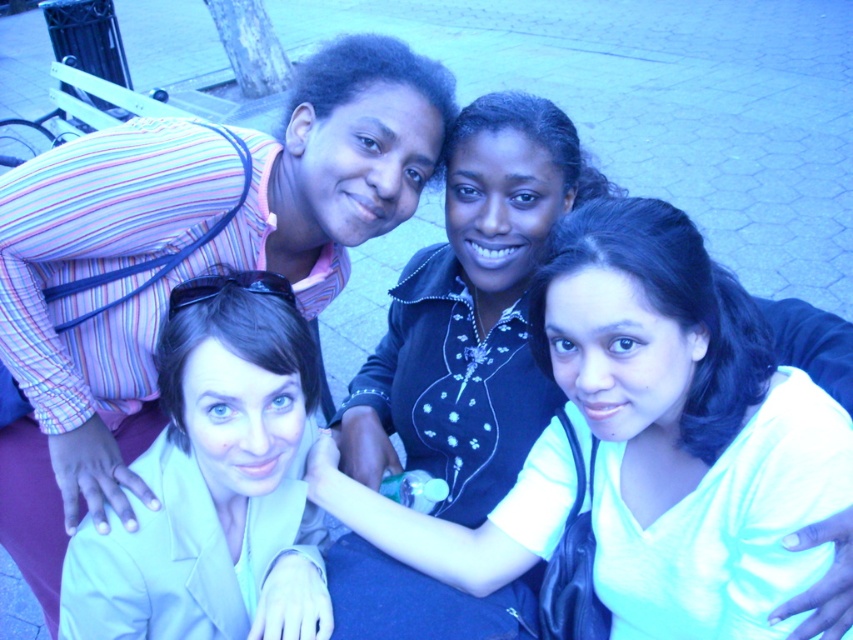
You are a photographer trying to adjust the lighting for a photo shoot. You notice two fabrics in the scene, the light blue fabric at center and the light beige fabric at lower left. Which fabric is closer to the camera?

The light blue fabric at center is closer to the camera because it is in front of the light beige fabric at lower left.

You are standing in front of the group photo taken at dusk. There is a point marked at coordinates (683, 428). What color fabric is located at that specific point?

The light blue fabric at center is located at point (683, 428).

Based on the scene description, which fabric, the light blue fabric at center or the light beige fabric at lower left, is bigger in size?

The light blue fabric at center is larger in size than the light beige fabric at lower left.